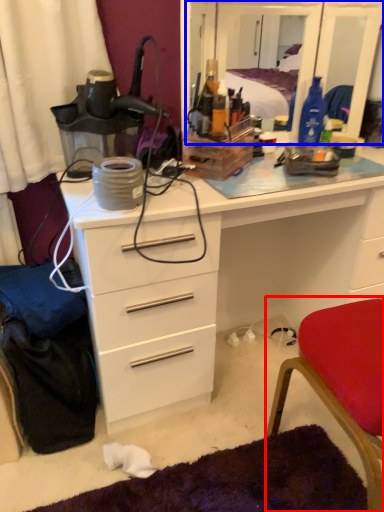
Question: Which point is closer to the camera, chair (highlighted by a red box) or mirror (highlighted by a blue box)?

Choices:
 (A) chair
 (B) mirror

Answer: (A)